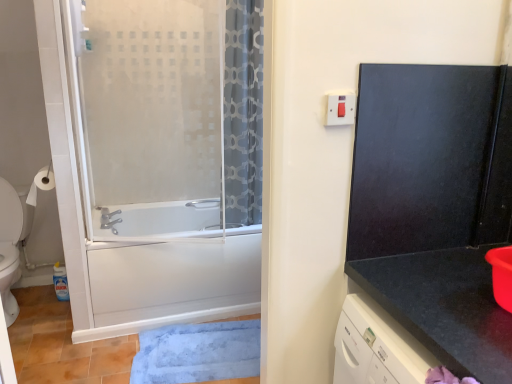
Question: Considering the relative positions of frosted glass screen door at left, arranged as the first screen door when viewed from the left, and white glossy toilet at left in the image provided, is frosted glass screen door at left, arranged as the first screen door when viewed from the left, to the left of white glossy toilet at left from the viewer's perspective?

Choices:
 (A) no
 (B) yes

Answer: (A)

Question: Could you tell me if frosted glass screen door at left, arranged as the first screen door when viewed from the left, is turned towards white glossy toilet at left?

Choices:
 (A) no
 (B) yes

Answer: (A)

Question: Can you confirm if frosted glass screen door at left, which is the 2th screen door in right-to-left order, is smaller than white glossy toilet at left?

Choices:
 (A) no
 (B) yes

Answer: (A)

Question: Is frosted glass screen door at left, arranged as the first screen door when viewed from the left, shorter than white glossy toilet at left?

Choices:
 (A) no
 (B) yes

Answer: (A)

Question: Is frosted glass screen door at left, which is the 2th screen door in right-to-left order, bigger than white glossy toilet at left?

Choices:
 (A) no
 (B) yes

Answer: (B)

Question: Would you say frosted glass screen door at left, which is the 2th screen door in right-to-left order, is inside or outside black granite countertop at right?

Choices:
 (A) outside
 (B) inside

Answer: (A)

Question: From a real-world perspective, is frosted glass screen door at left, which is the 2th screen door in right-to-left order, physically located above or below black granite countertop at right?

Choices:
 (A) above
 (B) below

Answer: (A)

Question: Is frosted glass screen door at left, arranged as the first screen door when viewed from the left, wider or thinner than black granite countertop at right?

Choices:
 (A) thin
 (B) wide

Answer: (A)

Question: Visually, is frosted glass screen door at left, arranged as the first screen door when viewed from the left, positioned to the left or to the right of black granite countertop at right?

Choices:
 (A) left
 (B) right

Answer: (A)

Question: Is white plastic switch at upper right inside the boundaries of blue plush bath mat at lower center, or outside?

Choices:
 (A) inside
 (B) outside

Answer: (B)

Question: Does point (339, 117) appear closer or farther from the camera than point (158, 344)?

Choices:
 (A) farther
 (B) closer

Answer: (B)

Question: In the image, is white plastic switch at upper right positioned in front of or behind blue plush bath mat at lower center?

Choices:
 (A) front
 (B) behind

Answer: (A)

Question: From their relative heights in the image, would you say white plastic switch at upper right is taller or shorter than blue plush bath mat at lower center?

Choices:
 (A) short
 (B) tall

Answer: (B)

Question: Choose the correct answer: Is white plastic switch at upper right inside frosted glass screen door at left, arranged as the first screen door when viewed from the left, or outside it?

Choices:
 (A) outside
 (B) inside

Answer: (A)

Question: From their relative heights in the image, would you say white plastic switch at upper right is taller or shorter than frosted glass screen door at left, which is the 2th screen door in right-to-left order?

Choices:
 (A) short
 (B) tall

Answer: (A)